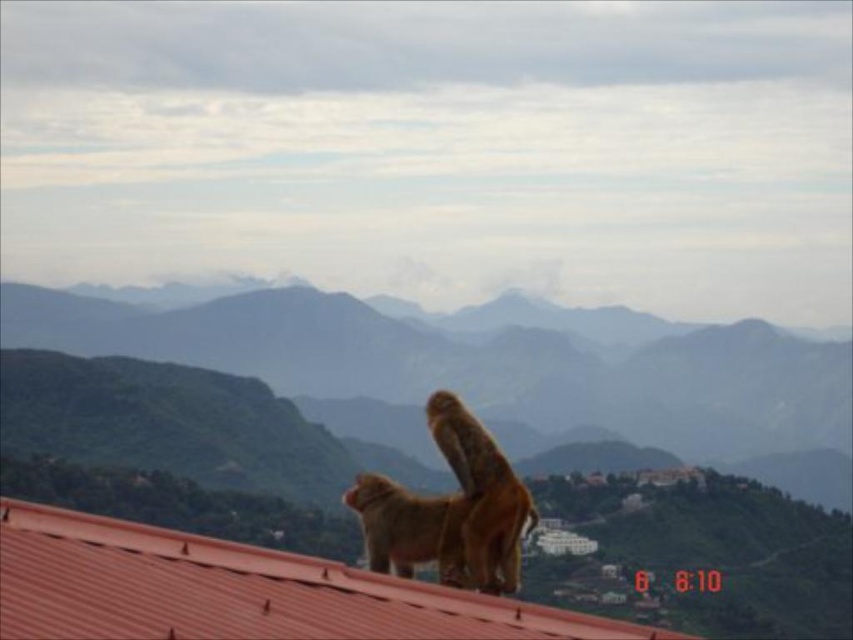
You are a drone operator trying to capture a photo of two points in the mountain landscape. The first point is at coordinate point (614, 554) and the second is at point (343, 595). From your current position, which point would you need to adjust your drone to focus on first if you want to capture them in the order they appear from closest to farthest?

Point (343, 595) should be focused on first since it is closer to you than point (614, 554), which is behind it.

You are a hiker planning to take a photo of the green textured mountain at upper center from the position of the point at point (x=431, y=440). Is the green textured mountain at upper center visible from this point?

Yes, the point at point (x=431, y=440) indicates the location of the green textured mountain at upper center, so it would be visible from that position.

You are a hiker planning to take a photo of the green textured mountain at upper center from the foreground. Given that the mountain is positioned at coordinates approximately 0.689 on the x and 0.506 on the y axis, where should you position yourself to ensure the mountain is centered in your camera frame?

To center the green textured mountain at upper center in your camera frame, position yourself directly below the mountain at the coordinates provided, ensuring the mountain is aligned with the center point of your viewfinder.